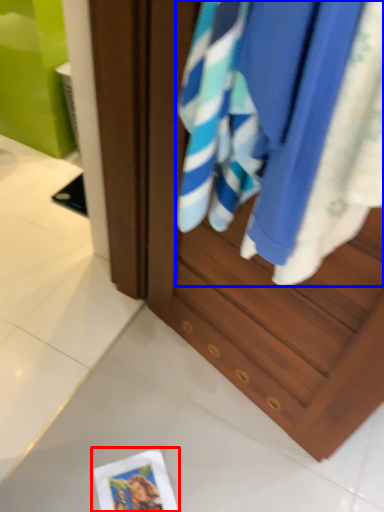
Question: Which of the following is the farthest to the observer, postcard (highlighted by a red box) or beach towel (highlighted by a blue box)?

Choices:
 (A) postcard
 (B) beach towel

Answer: (A)